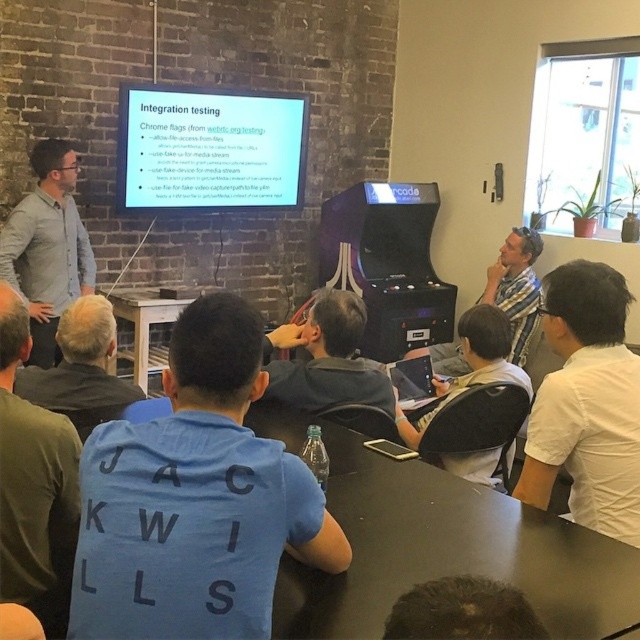
Question: Can you confirm if gray shirt at left is positioned to the right of dark gray shirt at lower center?

Choices:
 (A) no
 (B) yes

Answer: (A)

Question: Can you confirm if black matte table at lower center is positioned above white wood table at center?

Choices:
 (A) yes
 (B) no

Answer: (B)

Question: Among these objects, which one is farthest from the camera?

Choices:
 (A) green cotton shirt at lower left
 (B) gray shirt at left
 (C) dark gray shirt at lower center
 (D) matte black shirt at center

Answer: (B)

Question: Which object appears farthest from the camera in this image?

Choices:
 (A) white matte shirt at center
 (B) plaid shirt at right

Answer: (B)

Question: Does gray shirt at left appear under dark gray shirt at lower center?

Choices:
 (A) no
 (B) yes

Answer: (A)

Question: Based on their relative distances, which object is farther from the white wood table at center?

Choices:
 (A) white matte shirt at center
 (B) white glossy projector screen at upper center
 (C) plaid shirt at right
 (D) green cotton shirt at lower left

Answer: (A)